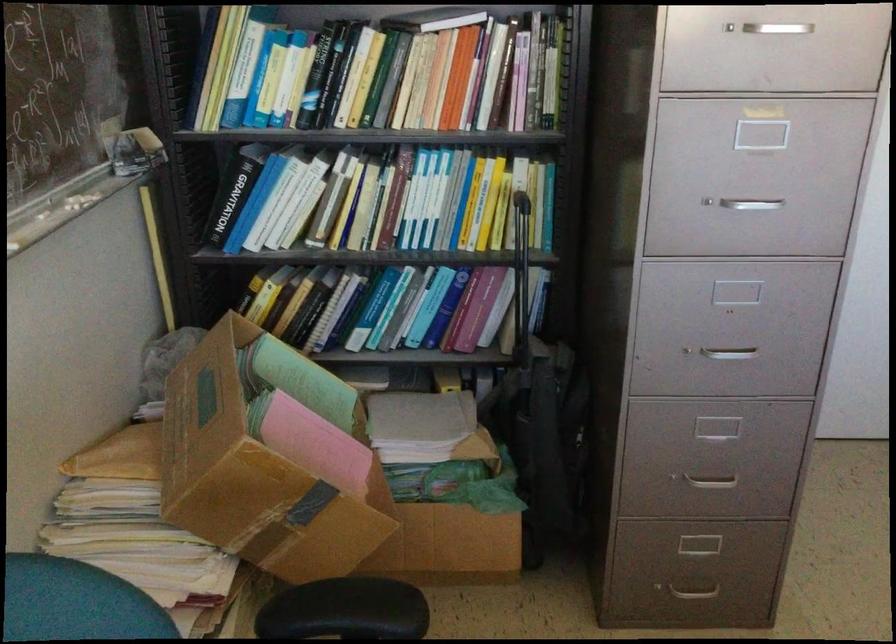
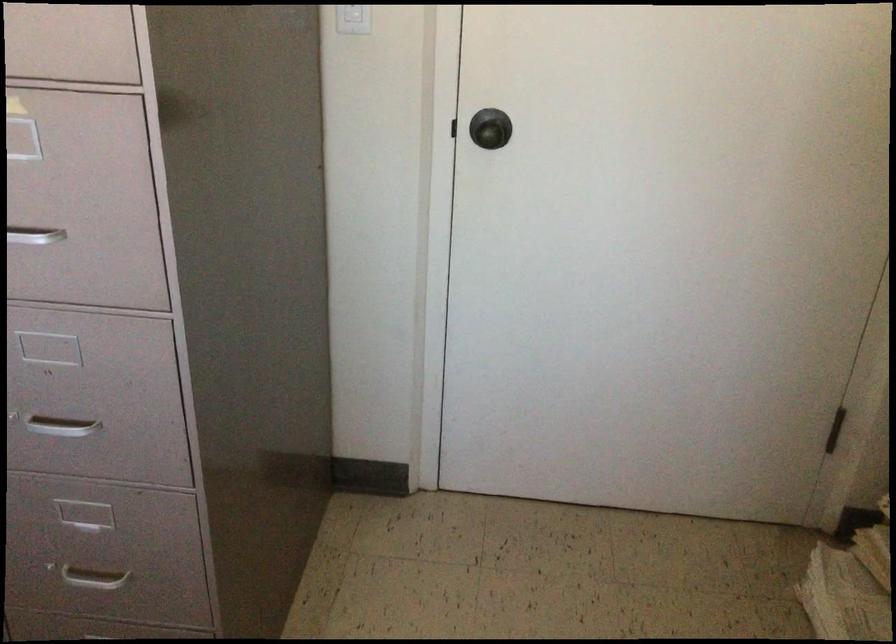
Which direction would the cameraman need to move to produce the second image?

The cameraman walked toward right, forward.